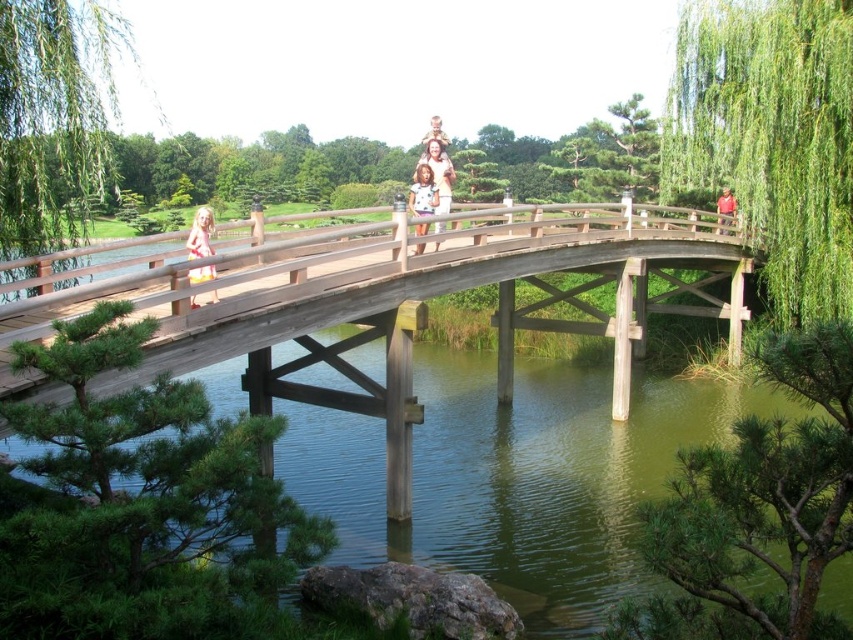
You are standing at the camera position and want to take a photo of the two points in the Japanese garden scene. Which point, point [218,298] or point [438,192], is closer to you?

Point [218,298] is closer to the camera than point [438,192].

You are a photographer aiming to capture the matte pink dress at left and the light brown wooden bridge at center in a single shot. Based on their positions, which object is closer to the camera?

The matte pink dress at left is below the light brown wooden bridge at center, so it is closer to the camera.